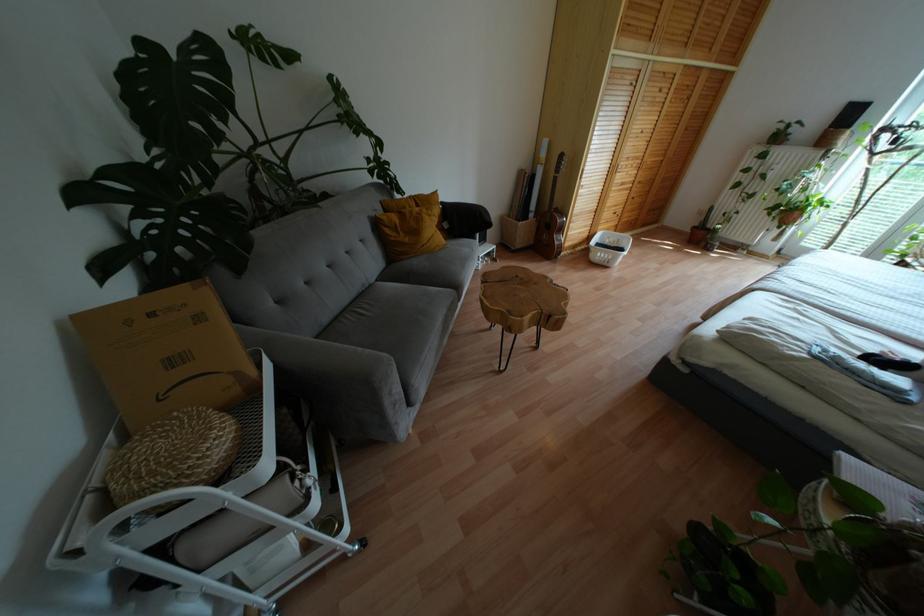
Locate an element on the screen. terracotta plant pot is located at coordinates (697, 235).